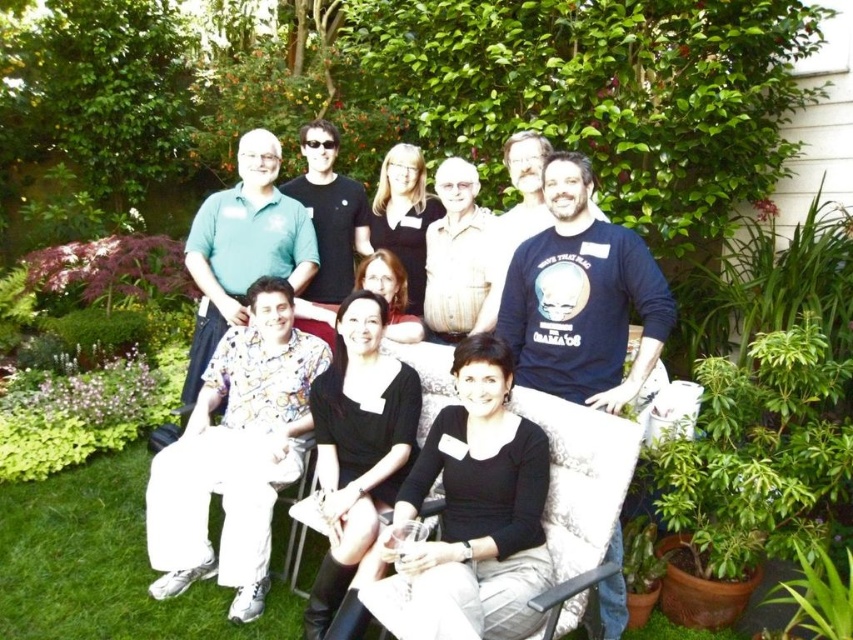
Question: Is matte black shirt at center below black matte dress at center?

Choices:
 (A) no
 (B) yes

Answer: (A)

Question: Is floral-patterned shirt at lower left to the left of black matte dress at center from the viewer's perspective?

Choices:
 (A) no
 (B) yes

Answer: (B)

Question: Which of the following is the farthest from the observer?

Choices:
 (A) (303, 392)
 (B) (286, 237)

Answer: (B)

Question: Does matte black shirt at center have a lesser width compared to green cotton shirt at upper left?

Choices:
 (A) no
 (B) yes

Answer: (A)

Question: Which point is farther to the camera?

Choices:
 (A) floral-patterned shirt at lower left
 (B) light brown textured shirt at center
 (C) black matte dress at center
 (D) matte black shirt at center

Answer: (B)

Question: Among these points, which one is nearest to the camera?

Choices:
 (A) (451, 176)
 (B) (349, 401)

Answer: (B)